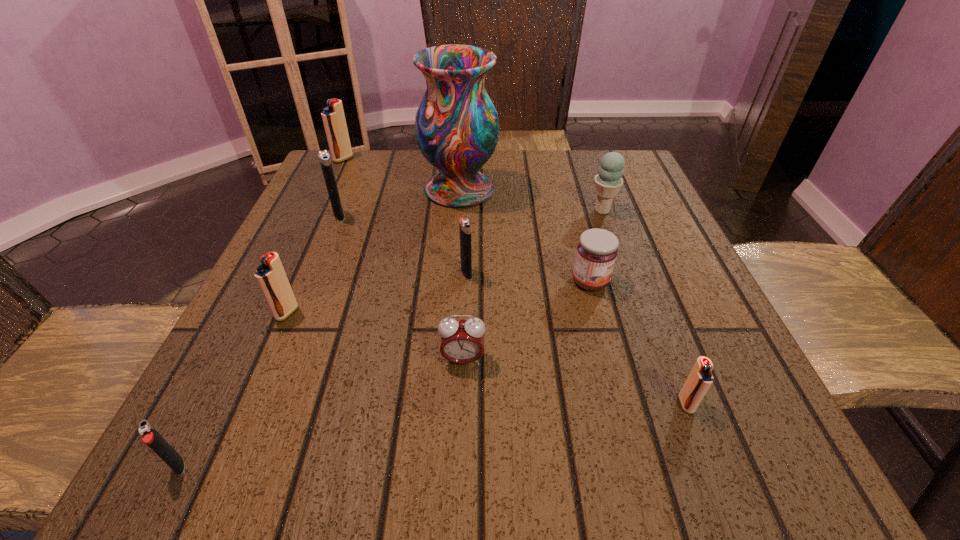
Identify the location of free area in between the farthest red igniter and the rightmost red igniter. The image size is (960, 540). (515, 281).

What are the coordinates of `vacant space that's between the biggest red igniter and the vase` in the screenshot? It's located at (401, 174).

This screenshot has height=540, width=960. I want to click on object that stands as the seventh closest to the eighth object from left to right, so click(324, 158).

Identify which object is the eighth nearest to the nearest red igniter. Please provide its 2D coordinates. Your answer should be formatted as a tuple, i.e. [(x, y)], where the tuple contains the x and y coordinates of a point satisfying the conditions above.

[(324, 158)]

Find the location of `igniter object that ranks as the sixth closest to the blue ice cream`. igniter object that ranks as the sixth closest to the blue ice cream is located at coordinates (150, 435).

Locate an element on the screen. The height and width of the screenshot is (540, 960). igniter that is the fourth closest to the alarm clock is located at coordinates (150, 435).

Locate an element on the screen. Image resolution: width=960 pixels, height=540 pixels. red igniter that is the second closest to the vase is located at coordinates (270, 275).

Identify which red igniter is the second nearest to the nearest object. Please provide its 2D coordinates. Your answer should be formatted as a tuple, i.e. [(x, y)], where the tuple contains the x and y coordinates of a point satisfying the conditions above.

[(700, 378)]

Locate an element on the screen. The height and width of the screenshot is (540, 960). black igniter that stands as the second closest to the smallest red igniter is located at coordinates (150, 435).

Locate which black igniter is the second closest to the jam. Please provide its 2D coordinates. Your answer should be formatted as a tuple, i.e. [(x, y)], where the tuple contains the x and y coordinates of a point satisfying the conditions above.

[(324, 158)]